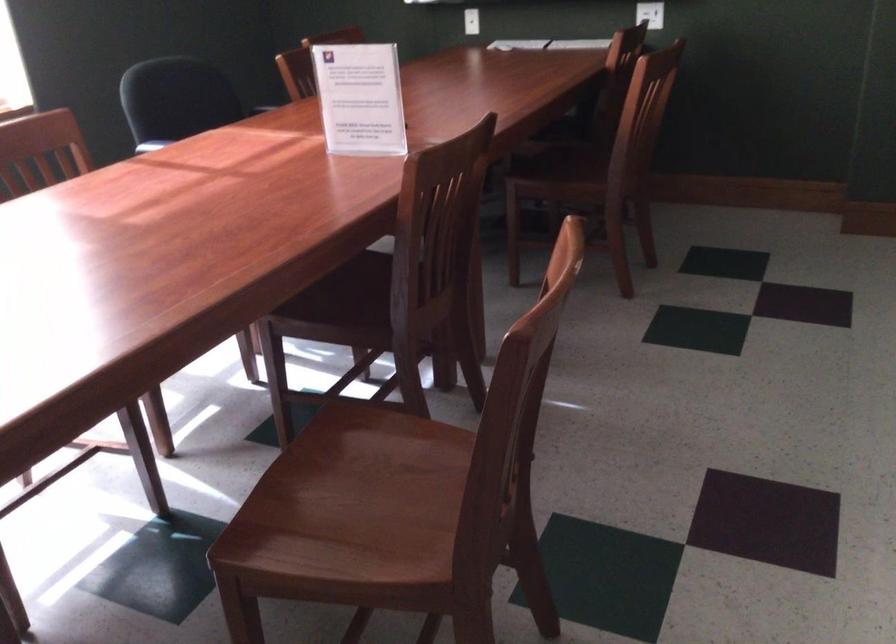
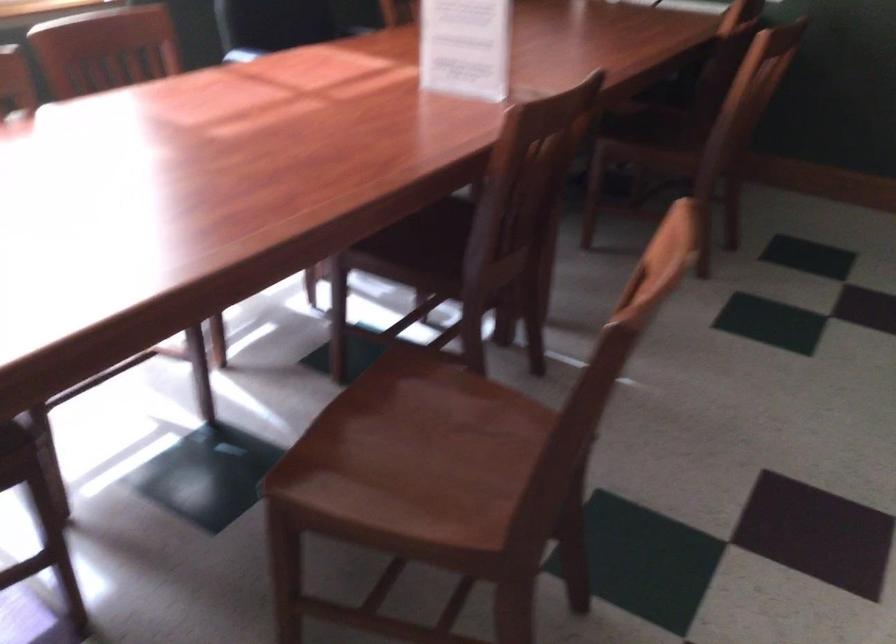
Where in the second image is the point corresponding to the point at 563,158 from the first image?

(659, 122)